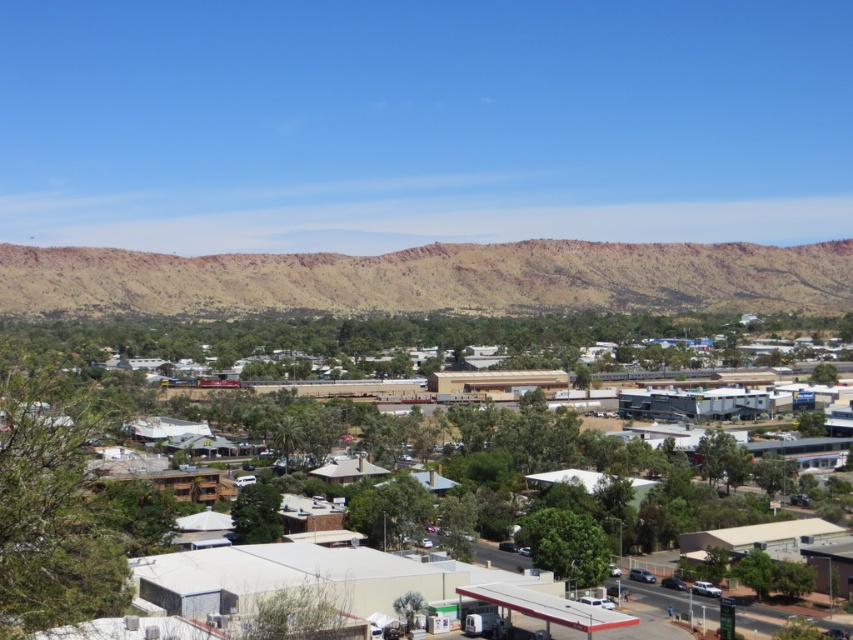
You are a city planner analyzing the layout of this area. You need to determine if the rustic sandstone mountain at center can be seen from the top of the white matte building at center. Based on their sizes and positions, what is your conclusion?

The rustic sandstone mountain at center is smaller than the white matte building at center. Since the mountain is smaller, it might be obscured by the building when viewed from the top, so it may not be visible.

You are a drone operator who needs to fly a drone from the rustic sandstone mountain at center to the white matte building at center. What is the minimum distance you need to cover in meters?

The minimum distance between the rustic sandstone mountain at center and the white matte building at center is 123.72 meters, so the drone needs to cover at least 123.72 meters.

You are a drone operator trying to capture aerial shots of the rustic sandstone mountain at center and the white matte building at center. From your current position, which one is positioned to the right side of the other?

The rustic sandstone mountain at center is to the right of the white matte building at center.